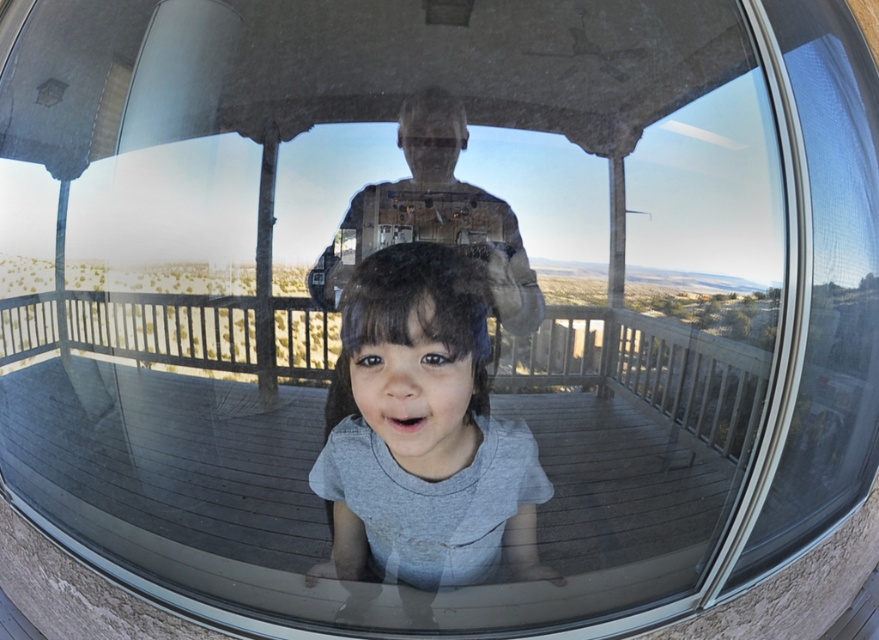
You are a photographer adjusting your camera settings to focus on the gray matte shirt at center and the matte gray shirt at center in the image. Since both shirts are the same color and texture, how can you determine which one is closer to the camera?

The gray matte shirt at center is closer to the camera than the matte gray shirt at center because it is described as being in front of it.

You are a photographer adjusting the focus on your camera. You need to ensure both the gray matte shirt at center and the matte gray shirt at center are in focus. Which one should you focus on first to account for their sizes?

You should focus on the gray matte shirt at center first because it has a greater height compared to the matte gray shirt at center, meaning it is larger and may require more precise focusing.

You are a photographer adjusting your camera settings. You notice two objects labeled as gray matte shirt at center and matte gray shirt at center in the scene. Which one is positioned to the left?

The gray matte shirt at center is positioned to the left of the matte gray shirt at center.